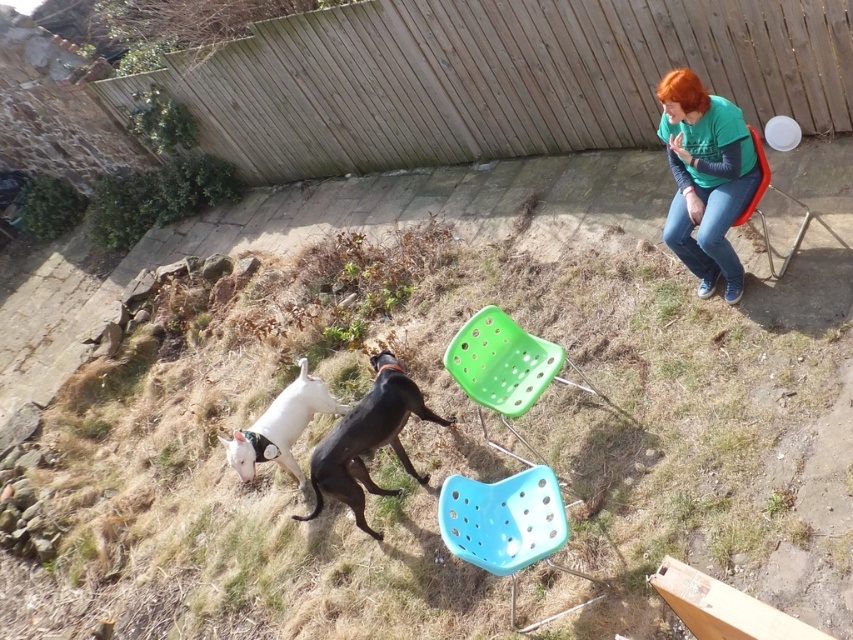
Who is lower down, blue plastic chair at lower center or black matte dog at lower center?

Positioned lower is blue plastic chair at lower center.

Can you confirm if blue plastic chair at lower center is wider than black matte dog at lower center?

No, blue plastic chair at lower center is not wider than black matte dog at lower center.

The image size is (853, 640). Find the location of `blue plastic chair at lower center`. blue plastic chair at lower center is located at coordinates (506, 525).

Between green fabric shirt at upper right and black matte dog at lower center, which one has less height?

With less height is black matte dog at lower center.

Does green fabric shirt at upper right lie behind black matte dog at lower center?

No, green fabric shirt at upper right is in front of black matte dog at lower center.

The height and width of the screenshot is (640, 853). What are the coordinates of `green fabric shirt at upper right` in the screenshot? It's located at (705, 179).

Does green fabric shirt at upper right have a greater height compared to blue plastic chair at lower center?

Yes.

Which is behind, point (671, 212) or point (535, 547)?

Point (671, 212)

The height and width of the screenshot is (640, 853). Identify the location of green fabric shirt at upper right. (705, 179).